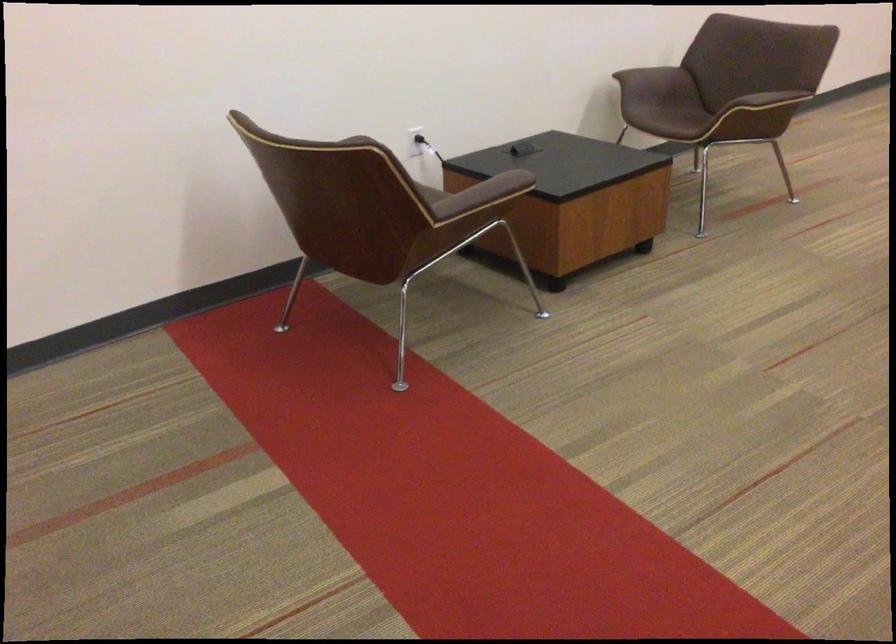
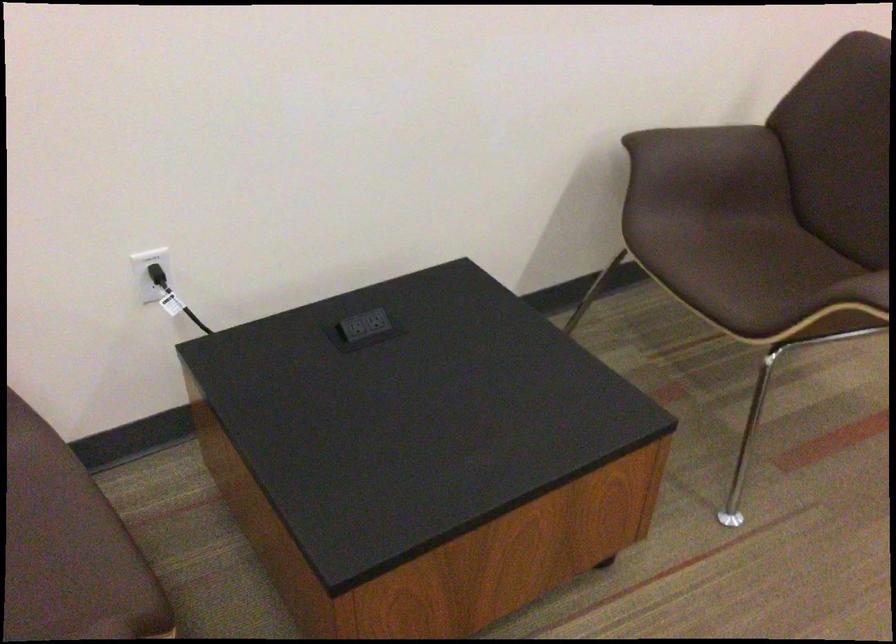
Question: Which direction would the cameraman need to move to produce the second image? Reply with the corresponding letter.

Choices:
 (A) Left
 (B) Right
 (C) Forward
 (D) Backward

Answer: (C)